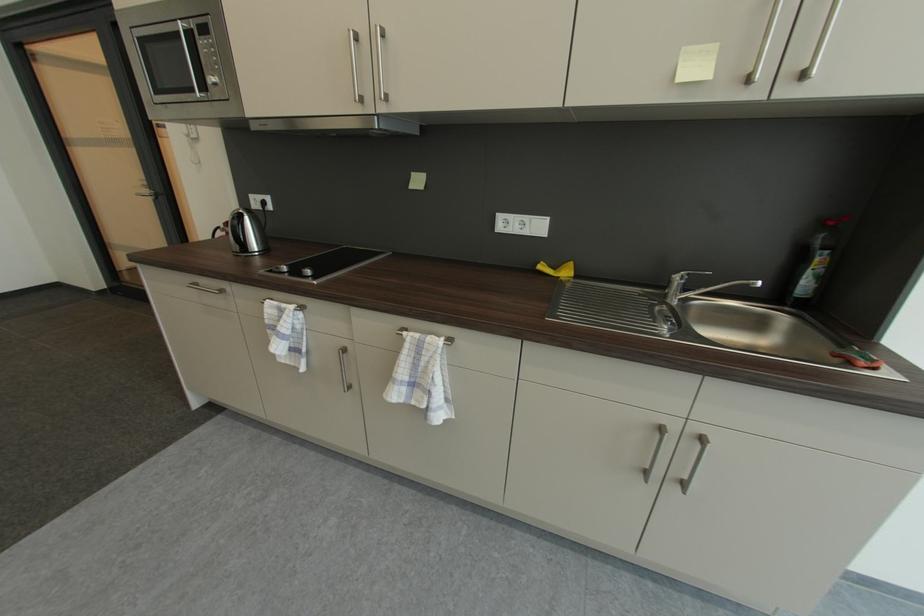
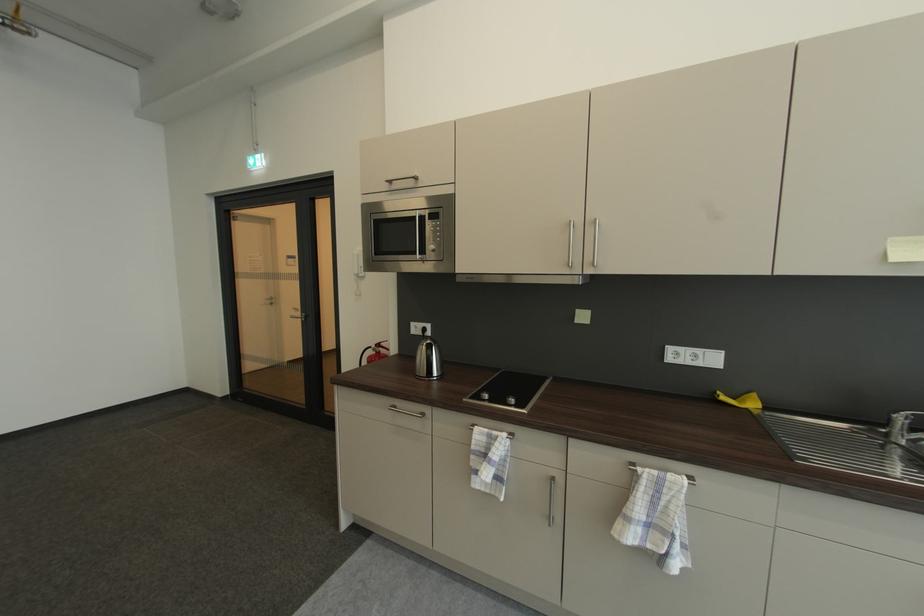
The point at (x=235, y=225) is marked in the first image. Where is the corresponding point in the second image?

(384, 347)